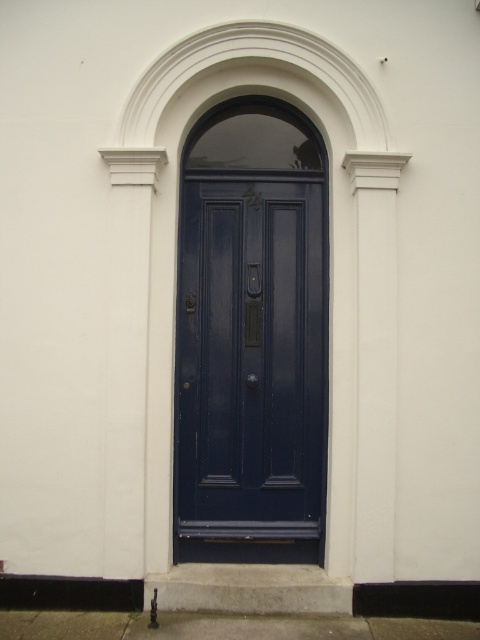
You are standing in front of the navy blue door with the white frame and transom window. You notice two points marked on the door. One is at point coordinates [322,401] and the other at [350,525]. From your perspective, which point is closer to you?

Point [322,401] is further to the viewer than point [350,525], so the point at [350,525] is closer to you.